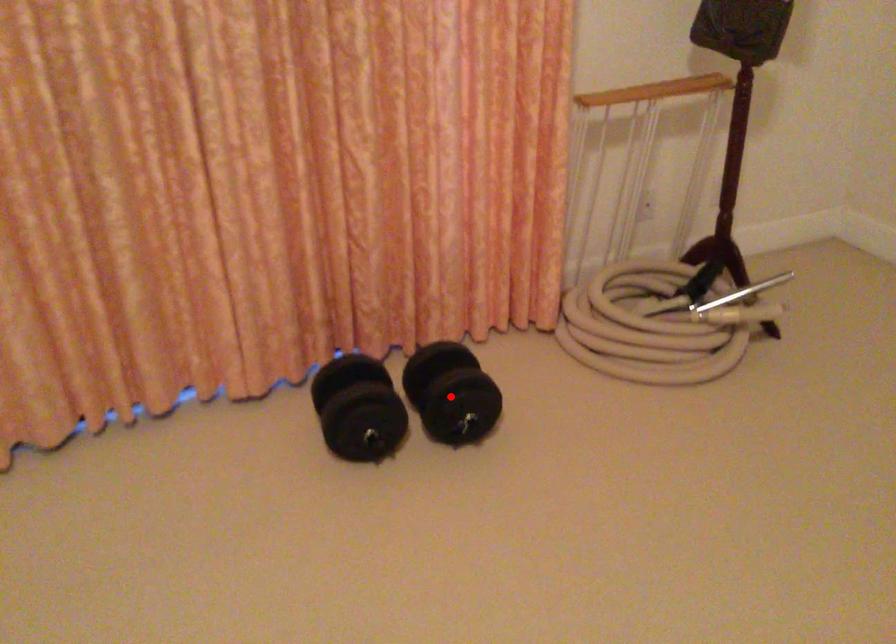
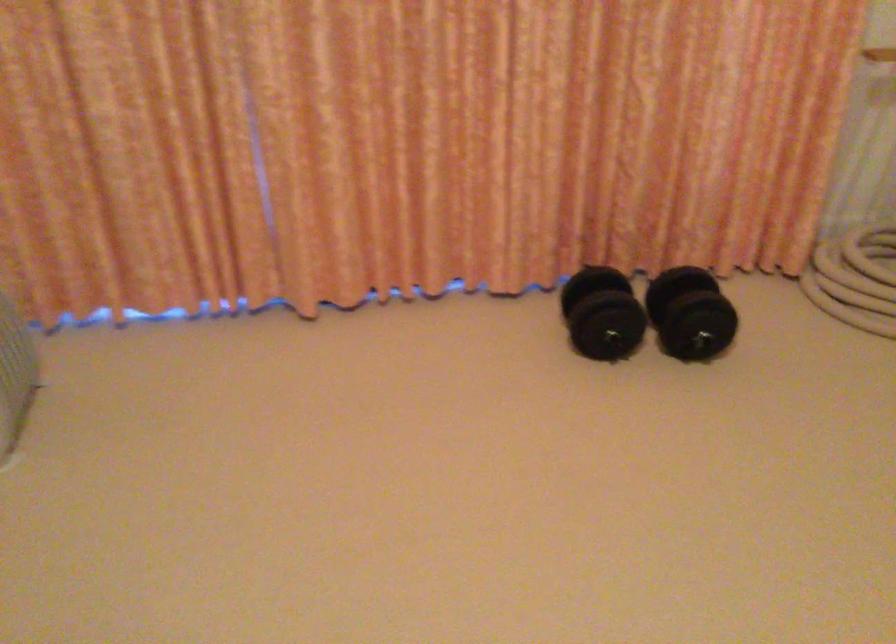
Find the pixel in the second image that matches the highlighted location in the first image.

(690, 313)